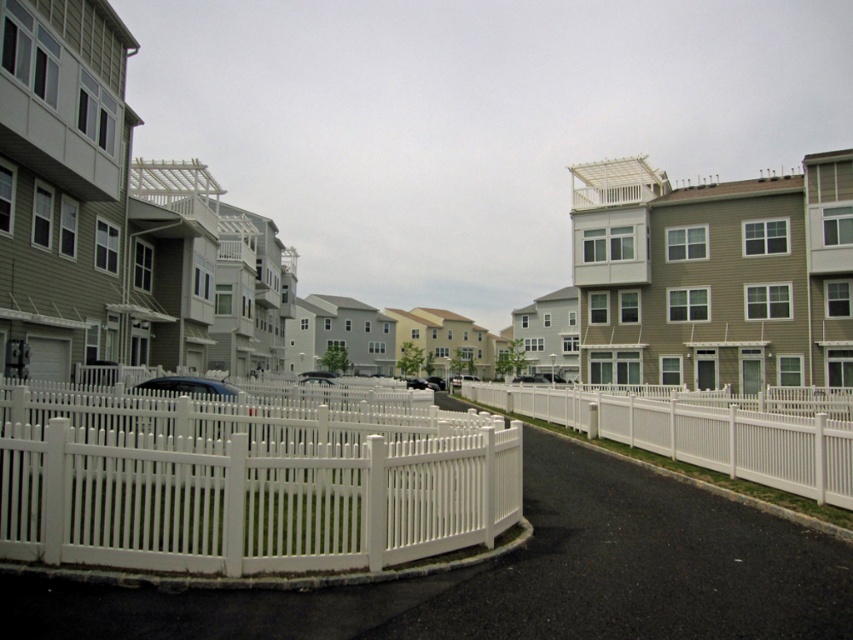
Question: Can you confirm if white picket fence at center is smaller than white vinyl fence at center?

Choices:
 (A) no
 (B) yes

Answer: (B)

Question: Which object appears closest to the camera in this image?

Choices:
 (A) white vinyl fence at center
 (B) white picket fence at center

Answer: (B)

Question: Among these objects, which one is farthest from the camera?

Choices:
 (A) white picket fence at center
 (B) white vinyl fence at center

Answer: (B)

Question: Which point is closer to the camera?

Choices:
 (A) white vinyl fence at center
 (B) white picket fence at center

Answer: (B)

Question: Does white picket fence at center appear on the right side of white vinyl fence at center?

Choices:
 (A) no
 (B) yes

Answer: (A)

Question: Does white picket fence at center have a greater width compared to white vinyl fence at center?

Choices:
 (A) no
 (B) yes

Answer: (B)